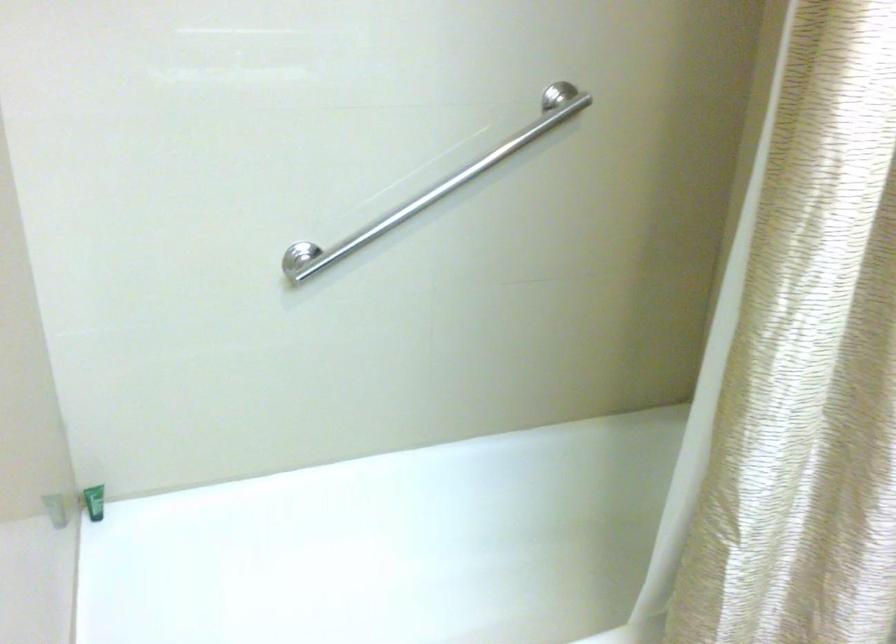
Question: How did the camera likely rotate?

Choices:
 (A) Left
 (B) Right
 (C) Up
 (D) Down

Answer: (B)